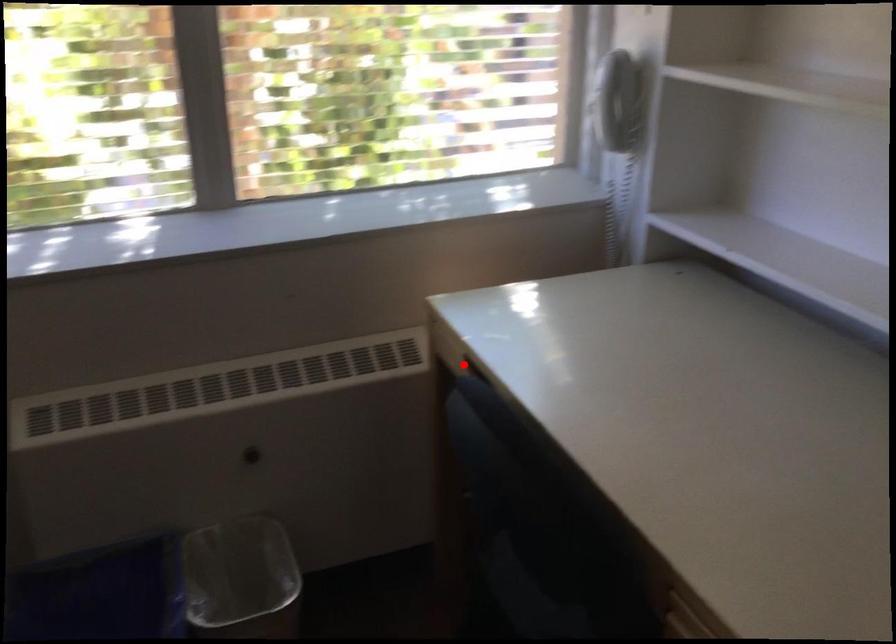
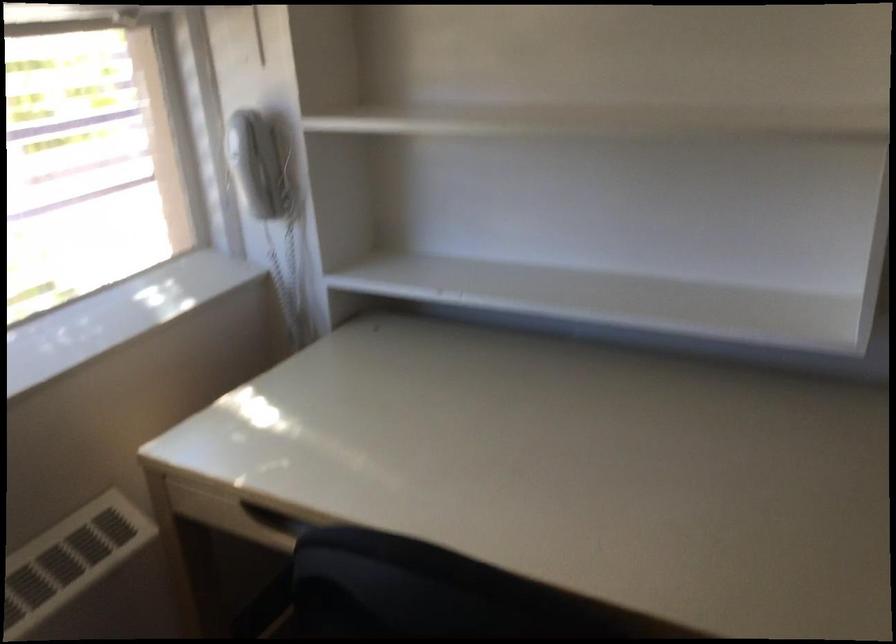
Question: I am providing you with two images of the same scene from different viewpoints. A red point is shown in image1. For the corresponding object point in image2, is it positioned nearer or farther from the camera?

Choices:
 (A) Nearer
 (B) Farther

Answer: (A)